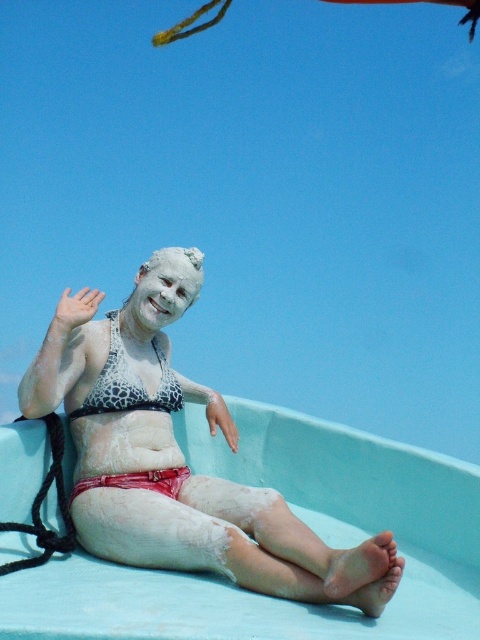
Describe the element at coordinates (178, 472) in the screenshot. I see `white matte bikini at center` at that location.

Between point (162, 369) and point (173, 276), which one is positioned in front?

Point (173, 276) is in front.

Which is behind, point (264, 577) or point (143, 310)?

The point (143, 310) is more distant.

Where is `white matte bikini at center`? white matte bikini at center is located at coordinates (178, 472).

Does white matte bikini at center have a larger size compared to leopard print bikini top at center?

Correct, white matte bikini at center is larger in size than leopard print bikini top at center.

Which is above, white matte bikini at center or leopard print bikini top at center?

leopard print bikini top at center is above.

Does point (141, 449) lie in front of point (134, 397)?

Yes, it is in front of point (134, 397).

This screenshot has height=640, width=480. Find the location of `white matte bikini at center`. white matte bikini at center is located at coordinates (178, 472).

Does leopard print bikini top at center come behind white matte face at center?

No, it is in front of white matte face at center.

Between point (115, 358) and point (193, 273), which one is positioned behind?

Point (193, 273)

Where is `leopard print bikini top at center`? The image size is (480, 640). leopard print bikini top at center is located at coordinates (129, 381).